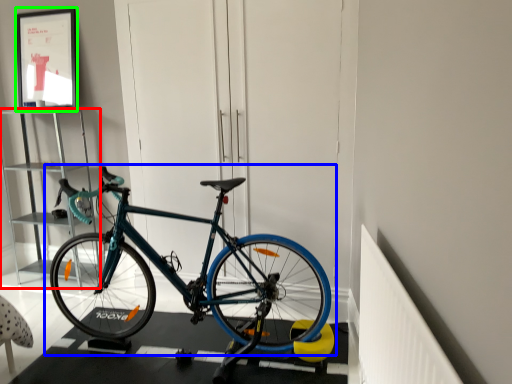
Question: Estimate the real-world distances between objects in this image. Which object is farther from cabinet (highlighted by a red box), bicycle (highlighted by a blue box) or picture frame (highlighted by a green box)?

Choices:
 (A) bicycle
 (B) picture frame

Answer: (A)